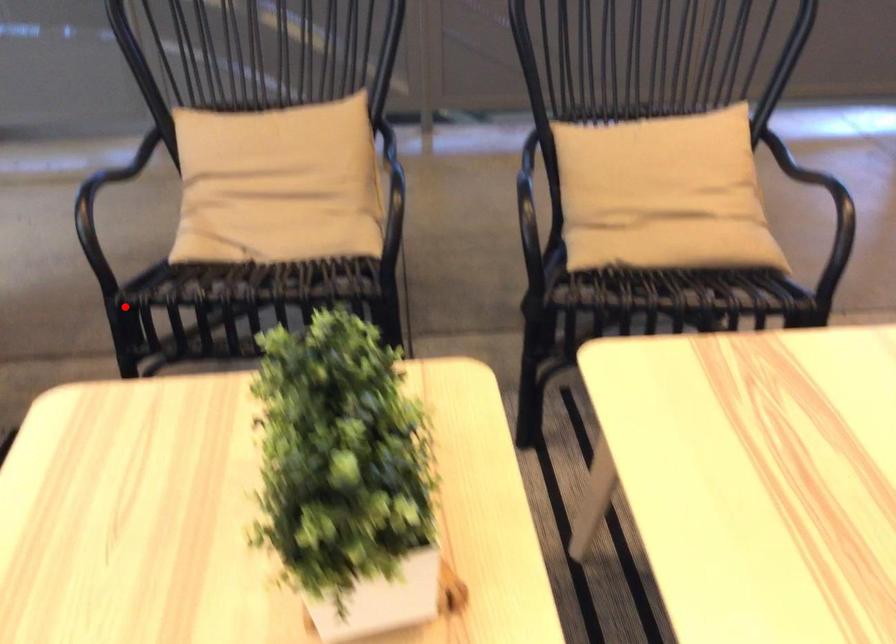
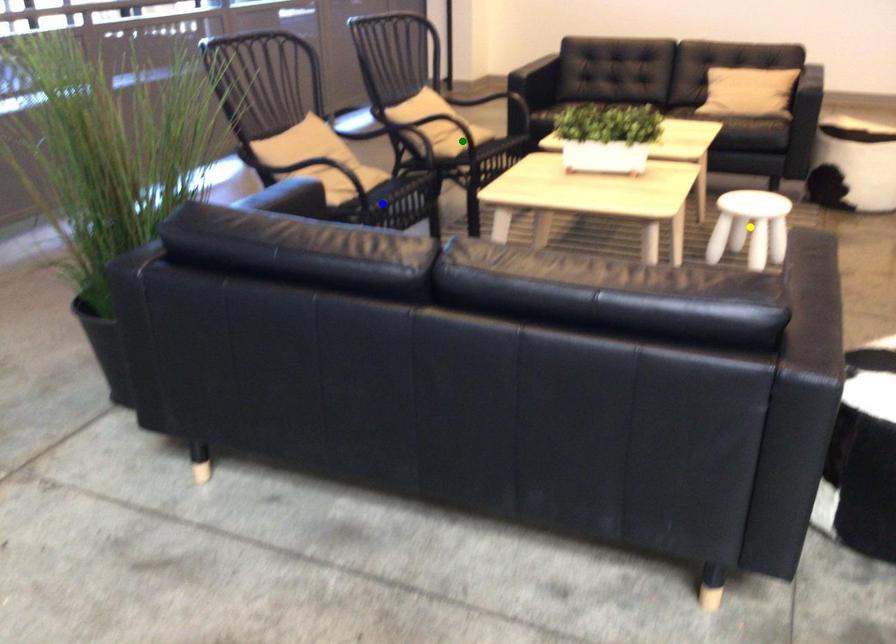
Question: I am providing you with two images of the same scene from different viewpoints. A red point is marked on the first image. You are given multiple points on the second image. Which spot in image 2 lines up with the point in image 1?

Choices:
 (A) yellow point
 (B) blue point
 (C) green point

Answer: (B)